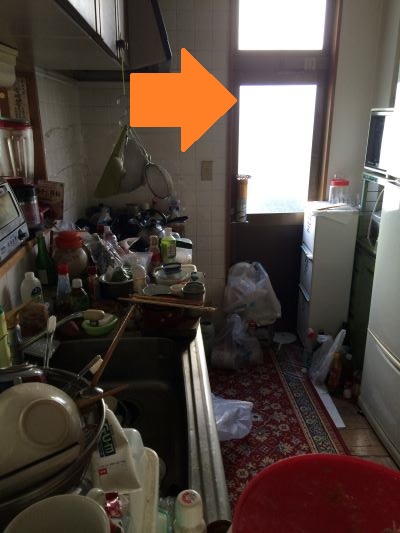
Find the location of a particular element. This screenshot has height=533, width=400. sink is located at coordinates (169, 422).